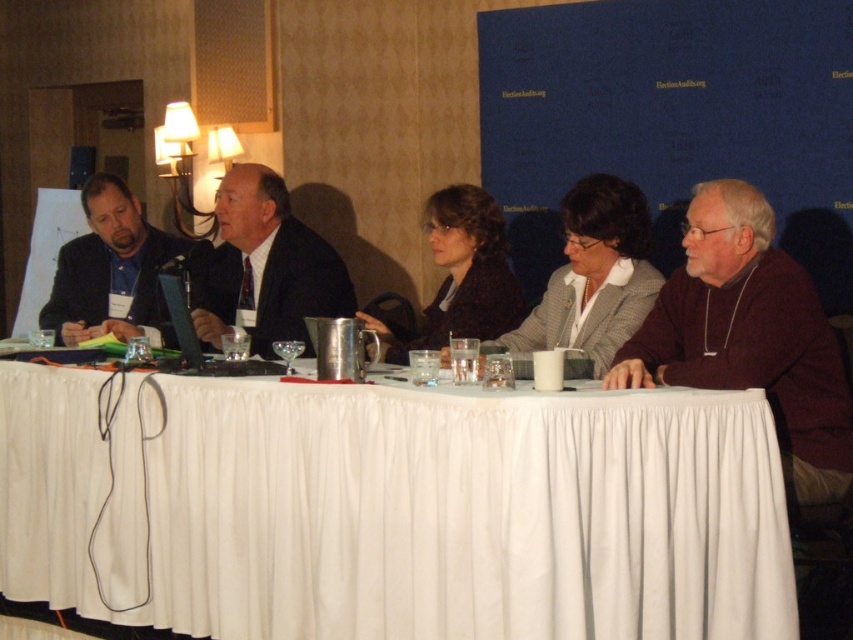
Which of these two, white fabric tablecloth at lower center or dark suit at center, stands taller?

With more height is white fabric tablecloth at lower center.

Who is more forward, (419, 627) or (210, 244)?

Point (419, 627) is more forward.

Locate an element on the screen. This screenshot has height=640, width=853. white fabric tablecloth at lower center is located at coordinates (410, 509).

Is dark suit at center thinner than dark brown textured sweater at center?

No.

Does dark suit at center appear over dark brown textured sweater at center?

Indeed, dark suit at center is positioned over dark brown textured sweater at center.

Is point (200, 272) farther from camera compared to point (497, 321)?

That is True.

Find the location of `dark suit at center`. dark suit at center is located at coordinates (264, 266).

Does white textured blazer at center lie in front of matte black suit at left?

Yes, white textured blazer at center is in front of matte black suit at left.

Can you confirm if white textured blazer at center is bigger than matte black suit at left?

No.

Who is more distant from viewer, (587, 198) or (74, 276)?

The point (74, 276) is behind.

What are the coordinates of `white textured blazer at center` in the screenshot? It's located at (593, 275).